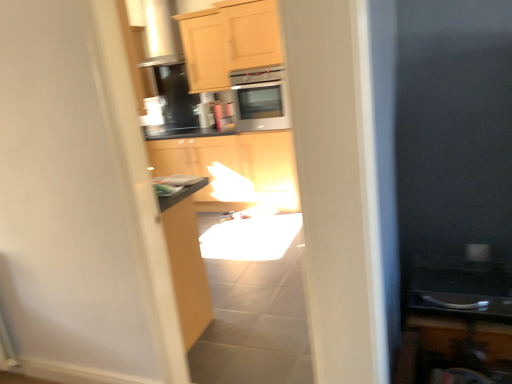
Question: Considering the relative sizes of satin silver microwave at center and light wood cabinet at upper center, acting as the second cabinetry starting from the back, in the image provided, is satin silver microwave at center wider than light wood cabinet at upper center, acting as the second cabinetry starting from the back,?

Choices:
 (A) yes
 (B) no

Answer: (A)

Question: Does satin silver microwave at center have a smaller size compared to light wood cabinet at upper center, acting as the second cabinetry starting from the back?

Choices:
 (A) yes
 (B) no

Answer: (B)

Question: Is satin silver microwave at center turned away from light wood cabinet at upper center, acting as the 2th cabinetry starting from the front?

Choices:
 (A) yes
 (B) no

Answer: (B)

Question: From the image's perspective, is satin silver microwave at center under light wood cabinet at upper center, the second cabinetry positioned from the left?

Choices:
 (A) no
 (B) yes

Answer: (B)

Question: Would you consider satin silver microwave at center to be distant from light wood cabinet at upper center, placed as the second cabinetry when sorted from right to left?

Choices:
 (A) no
 (B) yes

Answer: (A)

Question: Is the position of satin silver microwave at center less distant than that of light wood cabinet at upper center, acting as the second cabinetry starting from the back?

Choices:
 (A) yes
 (B) no

Answer: (A)

Question: Is light wood cabinet at upper center, placed as the second cabinetry when sorted from right to left, far from wooden cabinet at lower right, which is the 3th cabinetry from top to bottom?

Choices:
 (A) no
 (B) yes

Answer: (B)

Question: Considering the relative positions of light wood cabinet at upper center, acting as the 2th cabinetry starting from the front, and wooden cabinet at lower right, which is the 3th cabinetry from top to bottom, in the image provided, is light wood cabinet at upper center, acting as the 2th cabinetry starting from the front, to the right of wooden cabinet at lower right, which is the 3th cabinetry from top to bottom, from the viewer's perspective?

Choices:
 (A) no
 (B) yes

Answer: (A)

Question: Does light wood cabinet at upper center, placed as the second cabinetry when sorted from right to left, have a greater height compared to wooden cabinet at lower right, which is the third cabinetry from left to right?

Choices:
 (A) yes
 (B) no

Answer: (A)

Question: Can you confirm if light wood cabinet at upper center, placed as the second cabinetry when sorted from right to left, is positioned to the left of wooden cabinet at lower right, arranged as the first cabinetry when viewed from the right?

Choices:
 (A) no
 (B) yes

Answer: (B)

Question: Is light wood cabinet at upper center, the second cabinetry positioned from the left, wider than wooden cabinet at lower right, which is the third cabinetry from left to right?

Choices:
 (A) no
 (B) yes

Answer: (A)

Question: From a real-world perspective, is light wood cabinet at upper center, the second cabinetry positioned from the left, positioned over wooden cabinet at lower right, which is the third cabinetry from left to right, based on gravity?

Choices:
 (A) yes
 (B) no

Answer: (A)

Question: Is wooden cabinet at lower right, arranged as the first cabinetry when viewed from the right, not inside satin silver microwave at center?

Choices:
 (A) yes
 (B) no

Answer: (A)